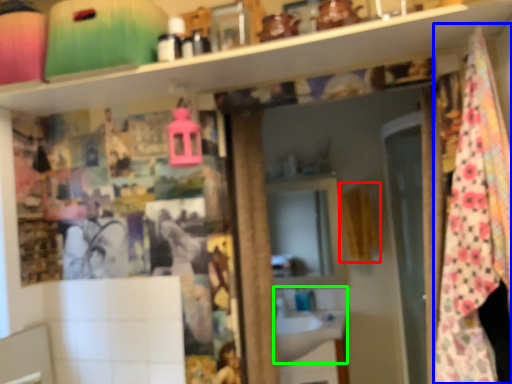
Question: Which object is positioned farthest from curtain (highlighted by a red box)? Select from blanket (highlighted by a blue box) and sink (highlighted by a green box).

Choices:
 (A) blanket
 (B) sink

Answer: (A)